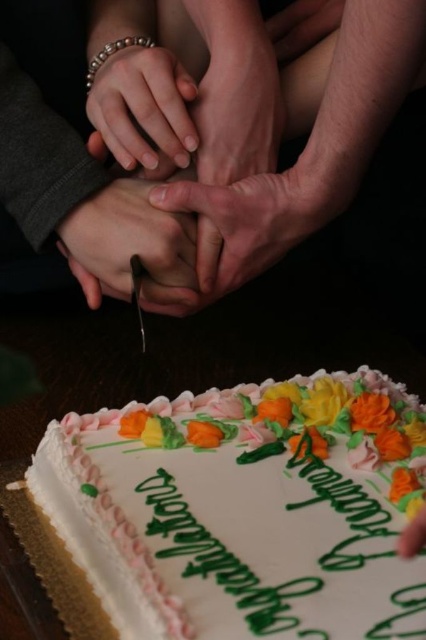
You are a photographer trying to capture the hands and bracelet in the scene. Since the matte skin hands at center and the matte gold bracelet at center are both in focus, which one appears taller in the photo?

The matte skin hands at center appears taller than the matte gold bracelet at center in the photo because the description states that the matte skin hands at center has a greater height compared to the matte gold bracelet at center.